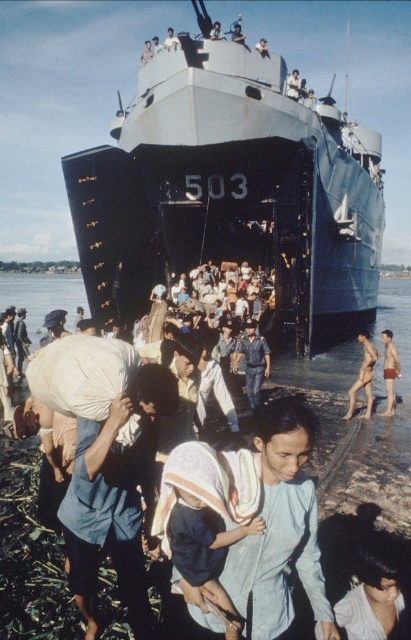
Between blue matte ship at center and dark blue fabric at center, which one appears on the right side from the viewer's perspective?

blue matte ship at center is more to the right.

Does blue matte ship at center appear under dark blue fabric at center?

Incorrect, blue matte ship at center is not positioned below dark blue fabric at center.

What are the coordinates of `blue matte ship at center` in the screenshot? It's located at (230, 189).

The width and height of the screenshot is (411, 640). What are the coordinates of `blue matte ship at center` in the screenshot? It's located at (230, 189).

Is point (265, 65) farther from viewer compared to point (20, 358)?

No, it is not.

Can you confirm if blue matte ship at center is thinner than light brown fabric bag at lower left?

Incorrect, blue matte ship at center's width is not less than light brown fabric bag at lower left's.

Is point (170, 150) closer to camera compared to point (18, 316)?

Yes, point (170, 150) is in front of point (18, 316).

The width and height of the screenshot is (411, 640). What are the coordinates of `blue matte ship at center` in the screenshot? It's located at (230, 189).

Does blue matte ship at center have a larger size compared to blue uniformed man at center?

Yes, blue matte ship at center is bigger than blue uniformed man at center.

Does blue matte ship at center appear under blue uniformed man at center?

Incorrect, blue matte ship at center is not positioned below blue uniformed man at center.

At what (x,y) coordinates should I click in order to perform the action: click on blue matte ship at center. Please return your answer as a coordinate pair (x, y). Looking at the image, I should click on (230, 189).

This screenshot has width=411, height=640. What are the coordinates of `blue matte ship at center` in the screenshot? It's located at (230, 189).